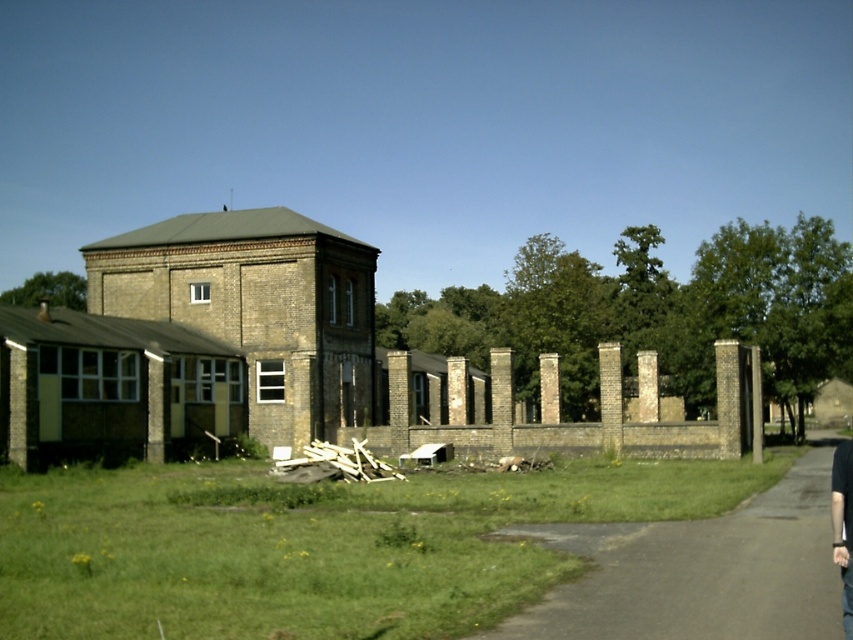
You are an inspector checking the construction site. You notice wooden planks at center and black fabric pants at lower right. Which object is located lower in the scene?

The wooden planks at center is located lower than the black fabric pants at lower right.

You are standing in front of the partially constructed building complex. There are two points marked on the structure. One is at coordinates point (x=347, y=448) and the other is at point (x=839, y=520). Which point is closer to you?

Point (x=347, y=448) is closer to you because it is further to the camera than point (x=839, y=520).